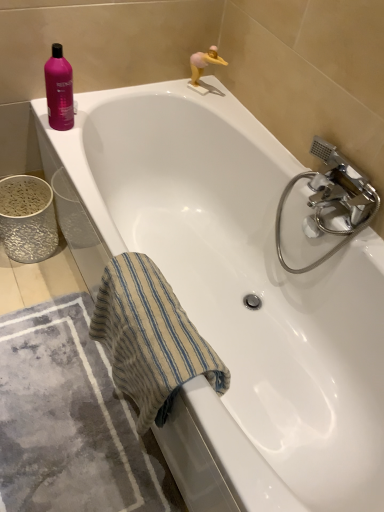
Locate an element on the screen. The height and width of the screenshot is (512, 384). free region on the left part of pink matte figurine at upper right is located at coordinates (175, 88).